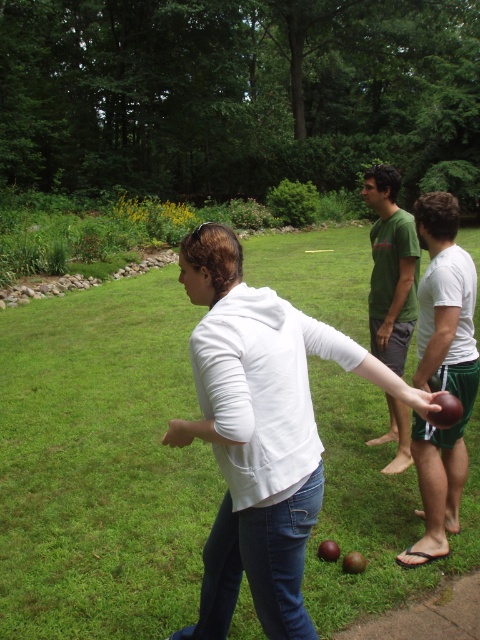
Looking at this image, what is the 2D coordinate of the green grass at center?

The 2D coordinate of the green grass at center is at point (100, 465).